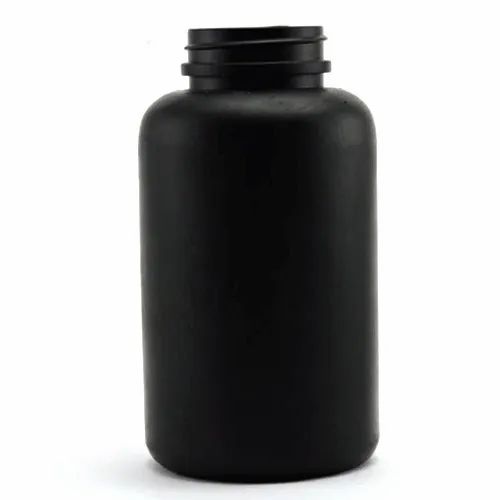
Find the location of a particular element. The height and width of the screenshot is (500, 500). left side of bottle is located at coordinates (146, 266).